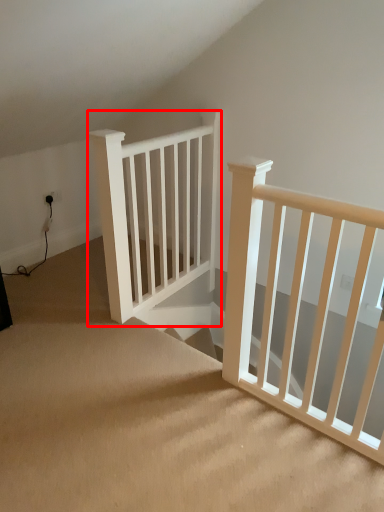
Question: From the image's perspective, where is rail (annotated by the red box) located in relation to stairs in the image?

Choices:
 (A) above
 (B) below

Answer: (A)